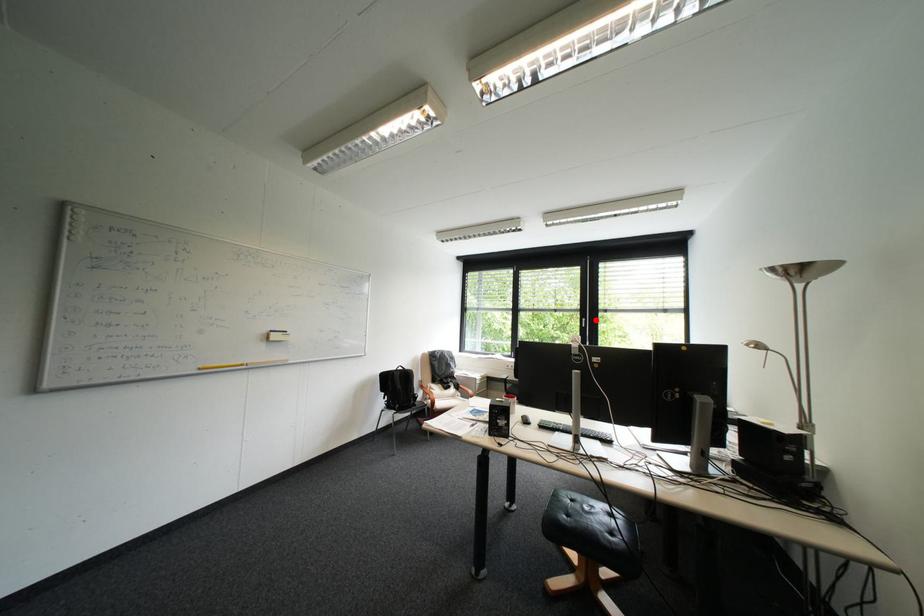
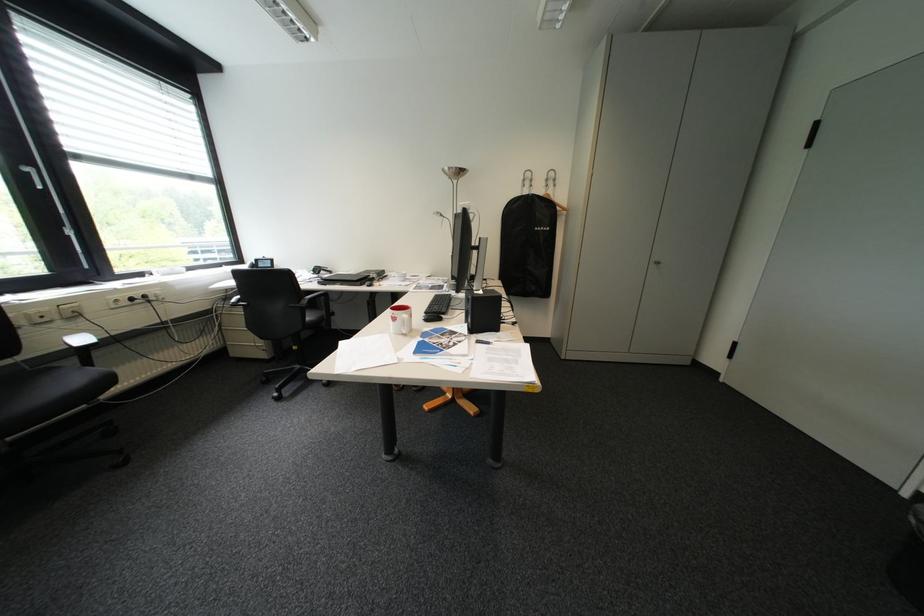
Where in the second image is the point corresponding to the highlighted location from the first image?

(41, 169)